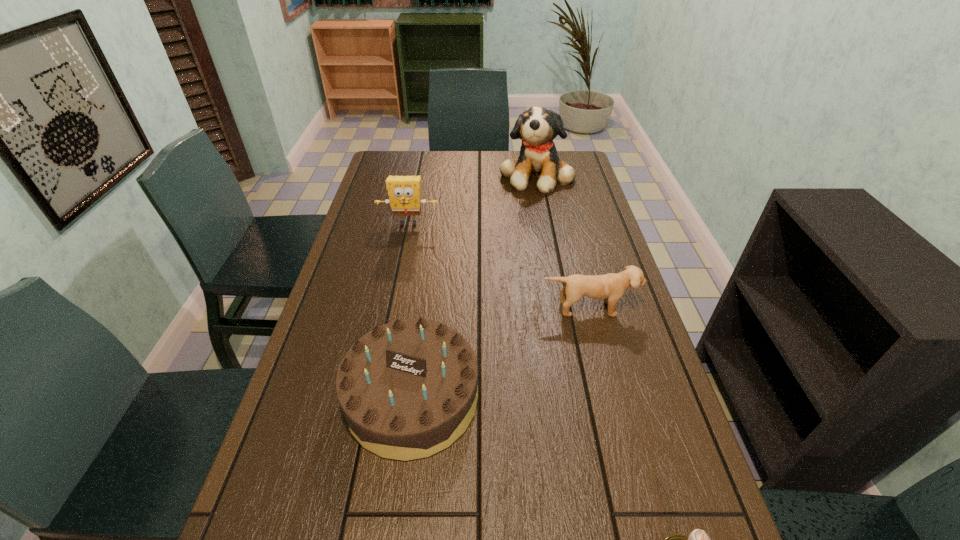
The image size is (960, 540). In order to click on free point between the nearer puppy and the sponge in this screenshot , I will do `click(499, 266)`.

Where is `free space that is in between the second farthest object and the farther puppy`? free space that is in between the second farthest object and the farther puppy is located at coordinates 472,199.

Where is `blank region between the sponge and the farther puppy`? blank region between the sponge and the farther puppy is located at coordinates (472, 199).

Locate an element on the screen. This screenshot has width=960, height=540. blank region between the tallest object and the nearer puppy is located at coordinates point(563,242).

You are a GUI agent. You are given a task and a screenshot of the screen. Output one action in this format:
    pyautogui.click(x=<x>, y=<y>)
    Task: Click on the object that stands as the second closest to the shortest object
    The width and height of the screenshot is (960, 540).
    Given the screenshot: What is the action you would take?
    pyautogui.click(x=610, y=287)

The height and width of the screenshot is (540, 960). What are the coordinates of `object that is the nearest to the third nearest object` in the screenshot? It's located at (408, 389).